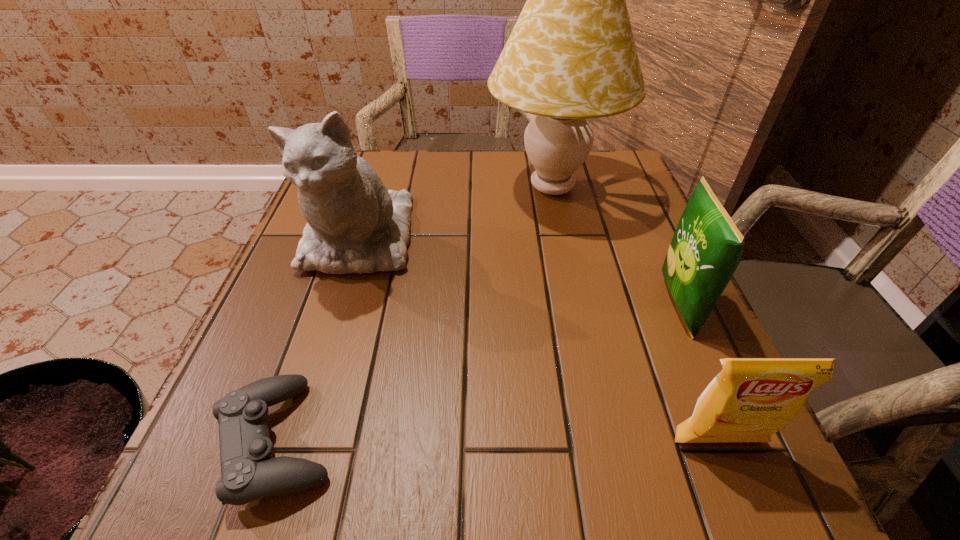
Where is `the tallest object`? the tallest object is located at coordinates (571, 56).

Where is `the fourth shortest object`? The image size is (960, 540). the fourth shortest object is located at coordinates (354, 224).

Find the location of a particular element. This screenshot has height=540, width=960. the farther crisp (potato chip) is located at coordinates (706, 249).

This screenshot has width=960, height=540. In order to click on the nearer crisp (potato chip) in this screenshot , I will do click(750, 399).

I want to click on control, so click(249, 472).

Where is `free space located 0.140m on the front of the tallest object`? Image resolution: width=960 pixels, height=540 pixels. free space located 0.140m on the front of the tallest object is located at coordinates (570, 272).

Find the location of a particular element. The width and height of the screenshot is (960, 540). free region located on the front-facing side of the cat is located at coordinates (313, 385).

Locate an element on the screen. free region located on the front-facing side of the farther crisp (potato chip) is located at coordinates (580, 306).

Locate an element on the screen. free point located on the front-facing side of the farther crisp (potato chip) is located at coordinates (488, 306).

Locate an element on the screen. free location located on the front-facing side of the farther crisp (potato chip) is located at coordinates (629, 306).